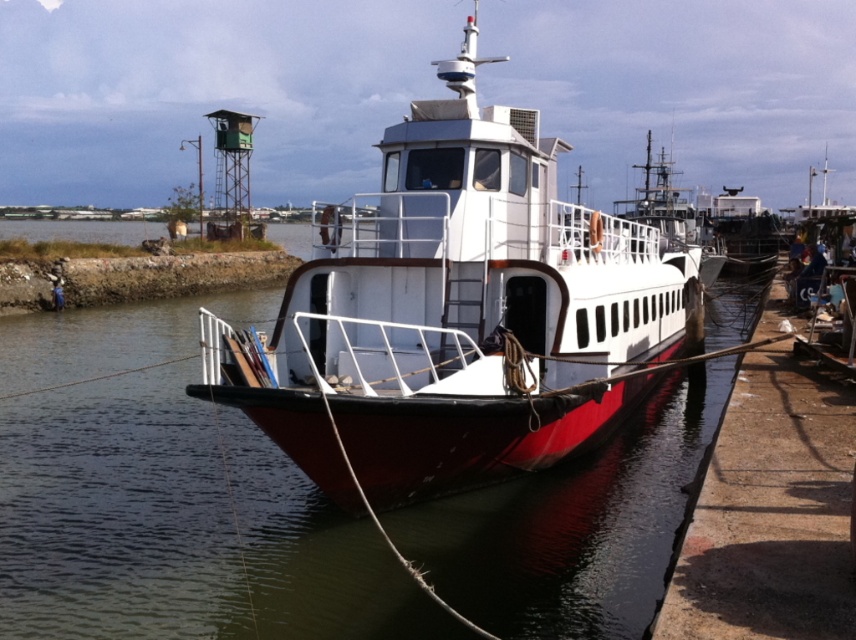
Is glossy water at center smaller than red matte boat at center?

Correct, glossy water at center occupies less space than red matte boat at center.

Which of these two, glossy water at center or red matte boat at center, stands taller?

red matte boat at center

Locate an element on the screen. The width and height of the screenshot is (856, 640). glossy water at center is located at coordinates (169, 497).

Is red matte boat at center thinner than white glossy ferry at center?

Correct, red matte boat at center's width is less than white glossy ferry at center's.

Is red matte boat at center bigger than white glossy ferry at center?

Correct, red matte boat at center is larger in size than white glossy ferry at center.

Locate an element on the screen. The height and width of the screenshot is (640, 856). red matte boat at center is located at coordinates (456, 314).

Can you confirm if glossy water at center is thinner than white glossy ferry at center?

Incorrect, glossy water at center's width is not less than white glossy ferry at center's.

From the picture: Who is more forward, (409, 516) or (672, 193)?

Point (409, 516) is in front.

Is point (76, 588) positioned before point (681, 211)?

Yes, point (76, 588) is closer to viewer.

You are a GUI agent. You are given a task and a screenshot of the screen. Output one action in this format:
    pyautogui.click(x=<x>, y=<y>)
    Task: Click on the glossy water at center
    The image size is (856, 640).
    Given the screenshot: What is the action you would take?
    pyautogui.click(x=169, y=497)